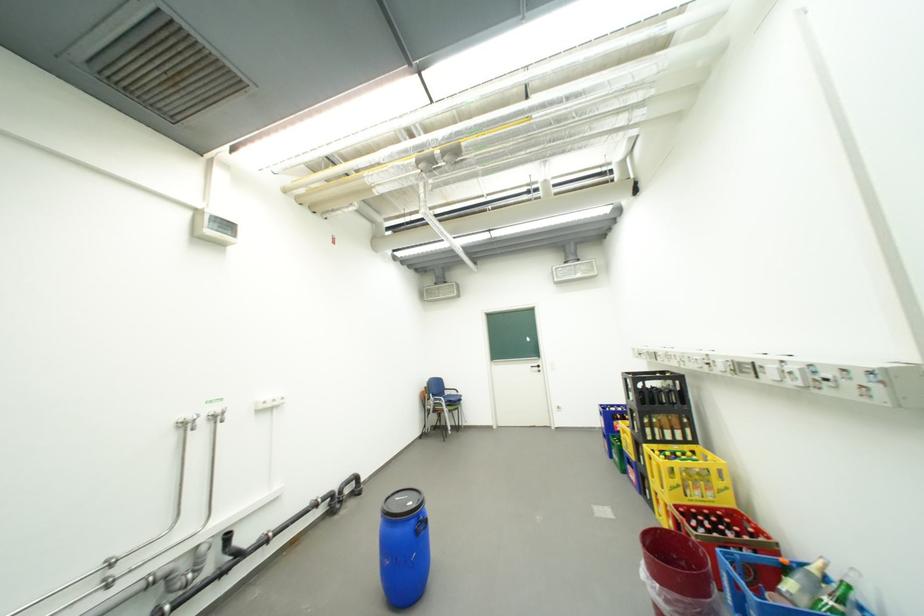
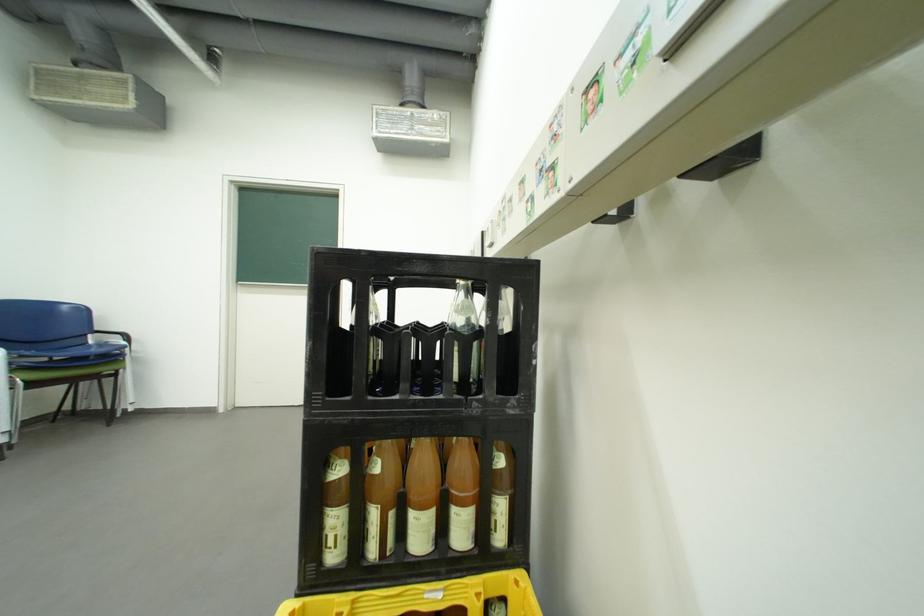
What movement of the cameraman would produce the second image?

The movement direction of the cameraman is right, forward.